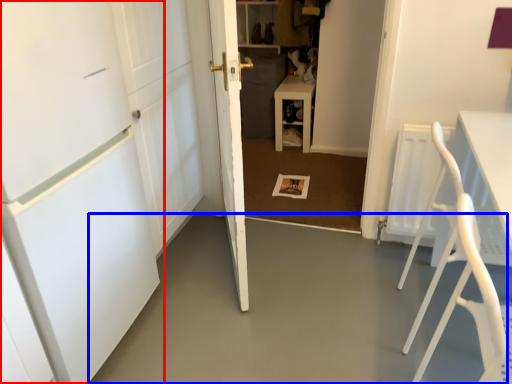
Question: Which of the following is the closest to the observer, door (highlighted by a red box) or concrete (highlighted by a blue box)?

Choices:
 (A) door
 (B) concrete

Answer: (A)